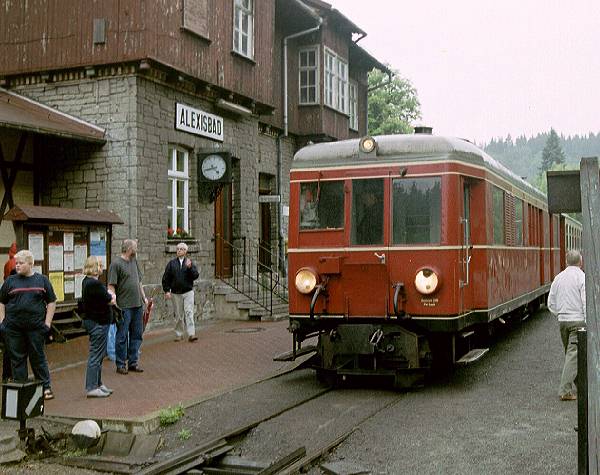
Identify the location of bulletins. (76, 255), (61, 261), (31, 241), (59, 280), (70, 281), (95, 245), (95, 235), (61, 240).